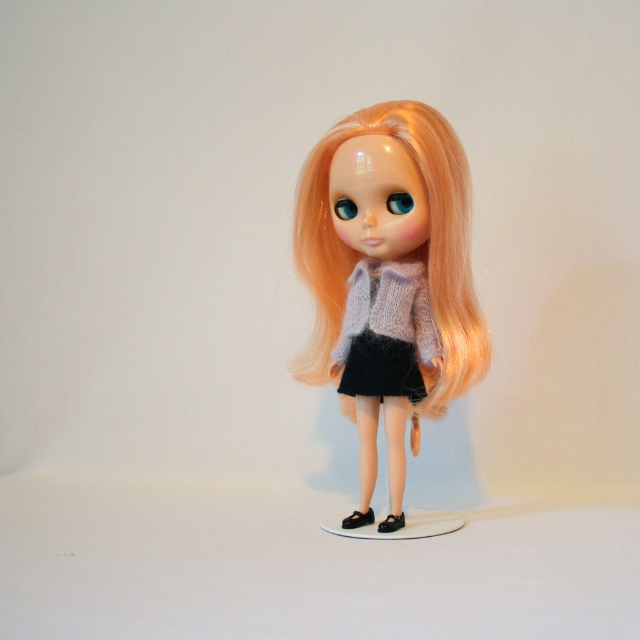
Is matte purple sweater at center positioned before black knitted dress at center?

Yes, it is.

You are a GUI agent. You are given a task and a screenshot of the screen. Output one action in this format:
    pyautogui.click(x=<x>, y=<y>)
    Task: Click on the matte purple sweater at center
    
    Given the screenshot: What is the action you would take?
    pyautogui.click(x=388, y=276)

Where is `matte purple sweater at center`? This screenshot has width=640, height=640. matte purple sweater at center is located at coordinates (388, 276).